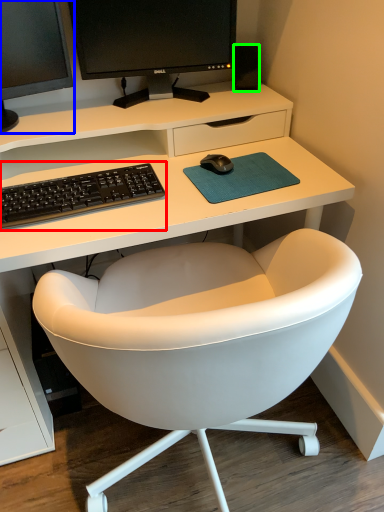
Question: Considering the real-world distances, which object is farthest from computer keyboard (highlighted by a red box)? computer monitor (highlighted by a blue box) or speaker (highlighted by a green box)?

Choices:
 (A) computer monitor
 (B) speaker

Answer: (B)